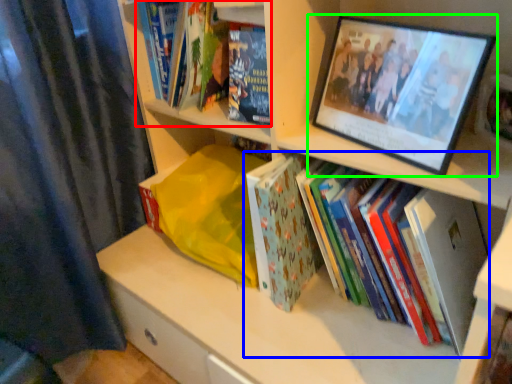
Question: Based on their relative distances, which object is farther from book (highlighted by a red box)? Choose from book (highlighted by a blue box) and picture frame (highlighted by a green box).

Choices:
 (A) book
 (B) picture frame

Answer: (A)